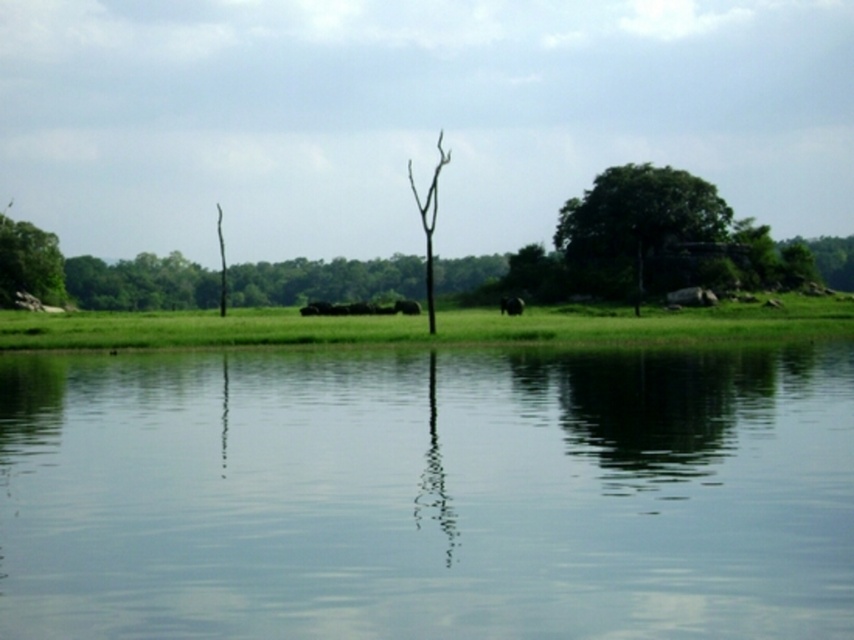
Question: Observing the image, what is the correct spatial positioning of green leafy tree at left in reference to brown fuzzy elephant at center?

Choices:
 (A) above
 (B) below

Answer: (A)

Question: Among these objects, which one is farthest from the camera?

Choices:
 (A) green leafy tree at upper right
 (B) brown fuzzy elephant at center
 (C) brown furry elephant at center

Answer: (C)

Question: Does transparent water at center come in front of green leafy tree at left?

Choices:
 (A) no
 (B) yes

Answer: (B)

Question: Based on their relative distances, which object is farther from the brown fuzzy elephant at center?

Choices:
 (A) green leafy tree at left
 (B) transparent water at center
 (C) brown furry elephant at center
 (D) green leafy tree at upper right

Answer: (B)

Question: Which point appears farthest from the camera in this image?

Choices:
 (A) (398, 304)
 (B) (45, 234)

Answer: (B)

Question: Is green leafy tree at left bigger than brown furry elephant at center?

Choices:
 (A) no
 (B) yes

Answer: (B)